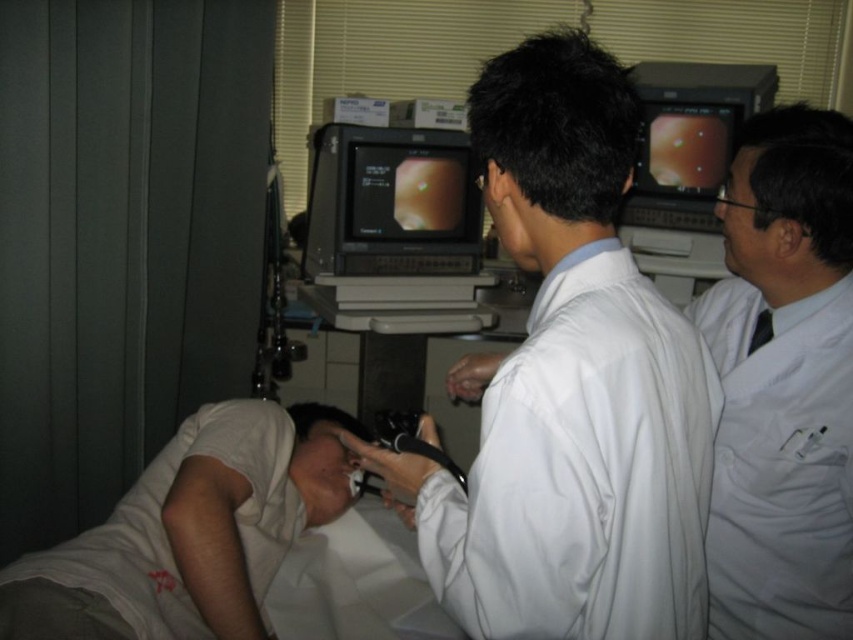
Does point (473, 561) come closer to viewer compared to point (219, 458)?

Yes, it is in front of point (219, 458).

Is point (604, 458) behind point (190, 528)?

No, it is in front of (190, 528).

What do you see at coordinates (570, 387) in the screenshot? I see `white smooth lab coat at center` at bounding box center [570, 387].

I want to click on white smooth lab coat at center, so click(570, 387).

Does point (715, 509) lie behind point (154, 608)?

That is False.

Which of these two, white lab coat at upper right or white cotton shirt at lower left, stands shorter?

Standing shorter between the two is white cotton shirt at lower left.

I want to click on white lab coat at upper right, so click(782, 384).

Identify the location of white lab coat at upper right. This screenshot has width=853, height=640. (782, 384).

Between white lab coat at upper right and black glossy monitor at center, which one appears on the right side from the viewer's perspective?

Positioned to the right is white lab coat at upper right.

From the picture: Does white lab coat at upper right have a smaller size compared to black glossy monitor at center?

Yes, white lab coat at upper right is smaller than black glossy monitor at center.

You are a GUI agent. You are given a task and a screenshot of the screen. Output one action in this format:
    pyautogui.click(x=<x>, y=<y>)
    Task: Click on the white lab coat at upper right
    The image size is (853, 640).
    Given the screenshot: What is the action you would take?
    pyautogui.click(x=782, y=384)